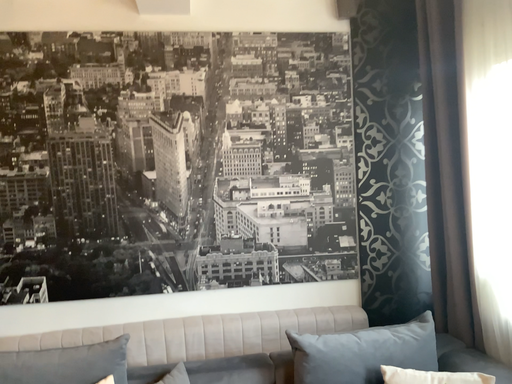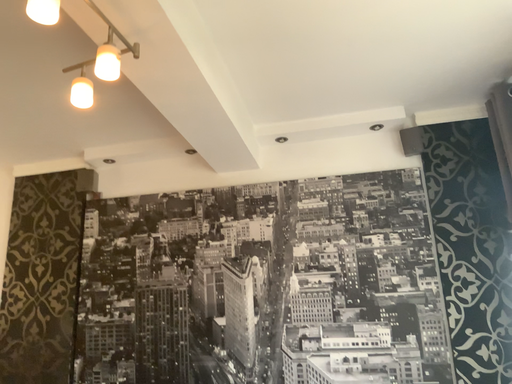
Question: How did the camera likely rotate when shooting the video?

Choices:
 (A) rotated upward
 (B) rotated downward

Answer: (A)